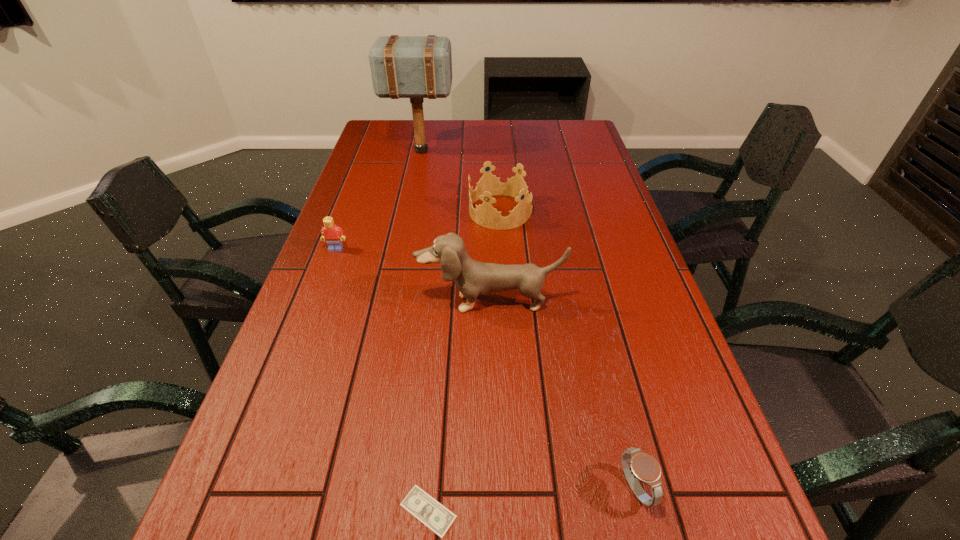
This screenshot has width=960, height=540. What are the coordinates of `vacant space that satisfies the following two spatial constraints: 1. on the back side of the money; 2. on the striking surface of the farthest object` in the screenshot? It's located at (457, 151).

This screenshot has width=960, height=540. Find the location of `vacant space that satisfies the following two spatial constraints: 1. on the front-facing side of the watch; 2. on the left side of the tiara`. vacant space that satisfies the following two spatial constraints: 1. on the front-facing side of the watch; 2. on the left side of the tiara is located at coordinates (516, 488).

The width and height of the screenshot is (960, 540). What are the coordinates of `vacant space that satisfies the following two spatial constraints: 1. on the striking surface of the mallet; 2. on the front-facing side of the third shortest object` in the screenshot? It's located at (400, 249).

In order to click on free space that satisfies the following two spatial constraints: 1. on the striking surface of the farthest object; 2. on the back side of the money in this screenshot , I will do `click(347, 511)`.

You are a GUI agent. You are given a task and a screenshot of the screen. Output one action in this format:
    pyautogui.click(x=<x>, y=<y>)
    Task: Click on the vacant area that satisfies the following two spatial constraints: 1. on the front-facing side of the tiara; 2. on the right side of the watch
    
    Given the screenshot: What is the action you would take?
    pyautogui.click(x=516, y=488)

Image resolution: width=960 pixels, height=540 pixels. What are the coordinates of `free space that satisfies the following two spatial constraints: 1. on the front-facing side of the second farthest object; 2. on the back side of the rightmost object` in the screenshot? It's located at (516, 488).

Identify the location of vacant space that satisfies the following two spatial constraints: 1. on the front-facing side of the second farthest object; 2. at the face of the fifth shortest object. The image size is (960, 540). click(506, 302).

At what (x,y) coordinates should I click in order to perform the action: click on vacant region that satisfies the following two spatial constraints: 1. on the front-facing side of the leftmost object; 2. on the right side of the watch. Please return your answer as a coordinate pair (x, y). The width and height of the screenshot is (960, 540). Looking at the image, I should click on (247, 488).